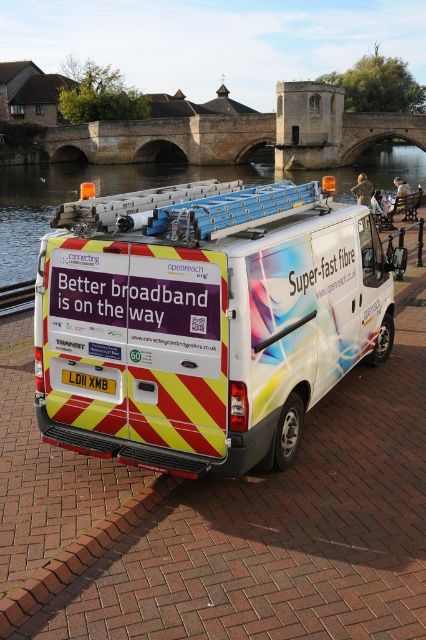
You are a delivery person who needs to cross the bridge to deliver a package. The clear water at center and brick at lower left are in your path. Which one do you need to avoid stepping into to prevent slipping?

You need to avoid stepping into the clear water at center because it is larger in size than the brick at lower left, making it more dangerous to step into.

You are standing at the point marked by the coordinates point (158, 186). What do you see directly in front of you?

You see clear water at center directly in front of you.